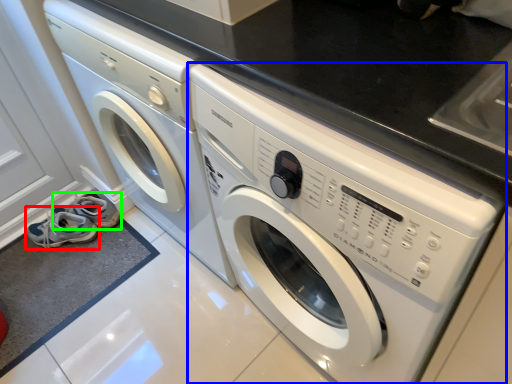
Question: Which object is positioned farthest from shoe (highlighted by a red box)? Select from washing machine (highlighted by a blue box) and shoe (highlighted by a green box).

Choices:
 (A) washing machine
 (B) shoe

Answer: (A)